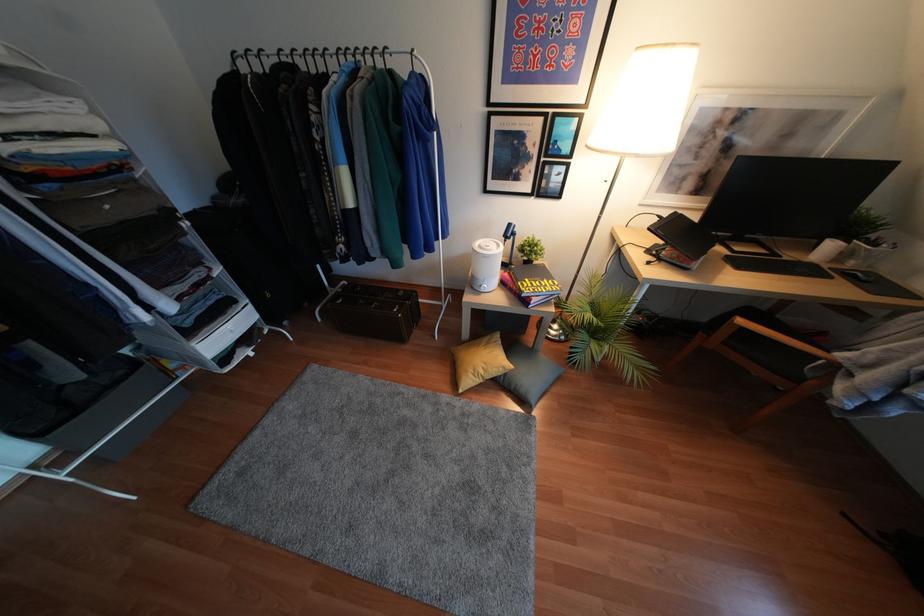
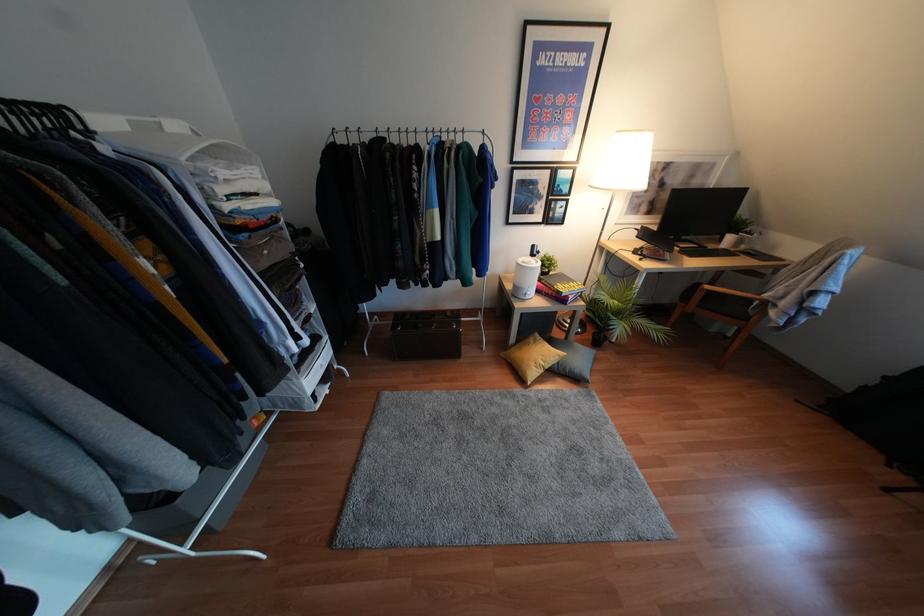
The point at [739,321] is marked in the first image. Where is the corresponding point in the second image?

(707, 286)